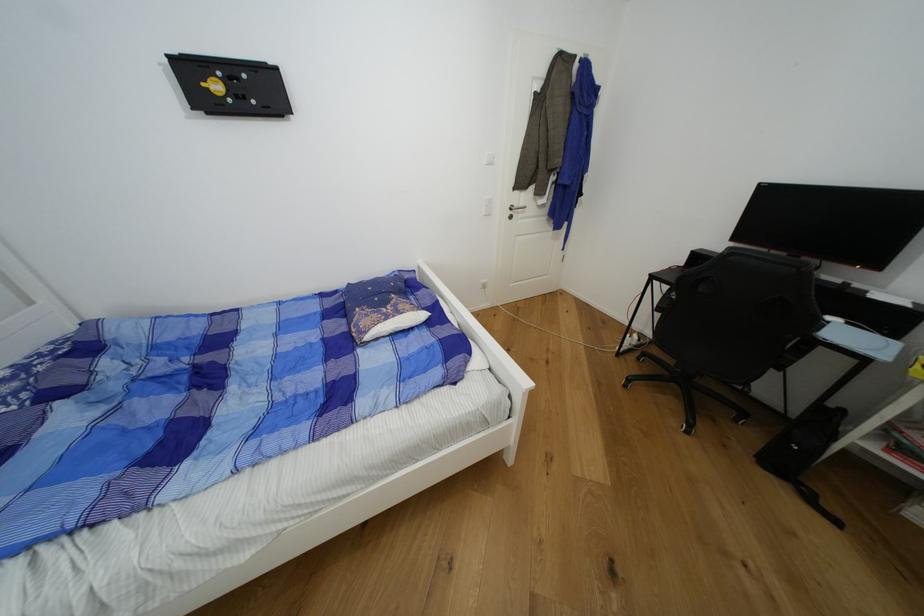
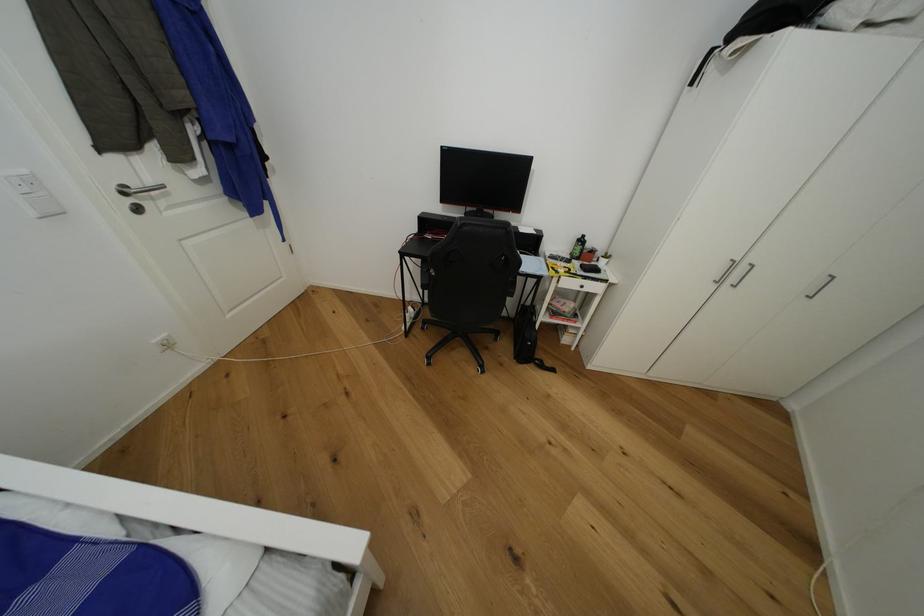
In the scene shown: First-person continuous shooting, in which direction is the camera rotating?

The camera rotated toward right-down.